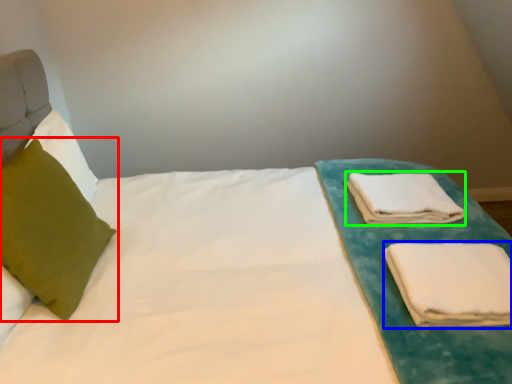
Question: Based on their relative distances, which object is farther from pillow (highlighted by a red box)? Choose from cloth (highlighted by a blue box) and cloth (highlighted by a green box).

Choices:
 (A) cloth
 (B) cloth

Answer: (B)